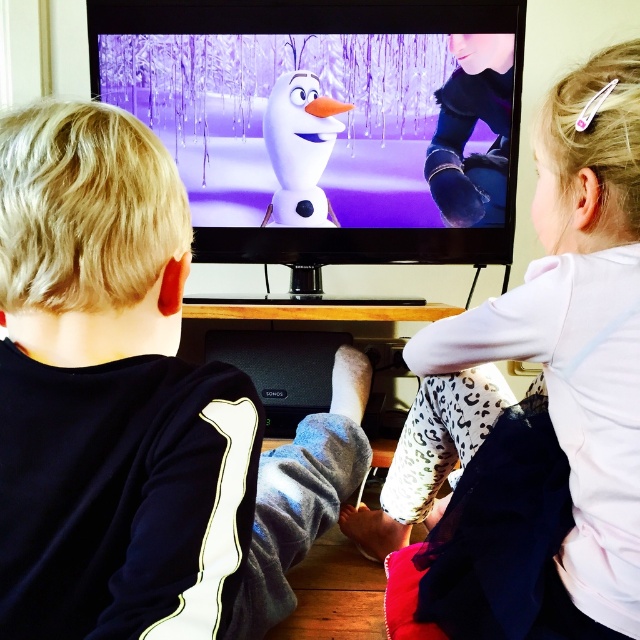
Looking at this image, which is above, black fleece shirt at left or white leopard print pants at lower right?

Positioned higher is black fleece shirt at left.

Identify the location of black fleece shirt at left. The width and height of the screenshot is (640, 640). (132, 408).

Between point (44, 266) and point (292, 97), which one is positioned behind?

The point (292, 97) is more distant.

Is black fleece shirt at left further to the viewer compared to matte white snowman at center?

No, black fleece shirt at left is in front of matte white snowman at center.

Between point (76, 595) and point (323, 198), which one is positioned behind?

Positioned behind is point (323, 198).

Find the location of a particular element. The image size is (640, 640). black fleece shirt at left is located at coordinates (132, 408).

Which is above, black fleece shirt at left or white matte snowman at center?

Positioned higher is white matte snowman at center.

Can you confirm if black fleece shirt at left is thinner than white matte snowman at center?

Correct, black fleece shirt at left's width is less than white matte snowman at center's.

What are the coordinates of `black fleece shirt at left` in the screenshot? It's located at (132, 408).